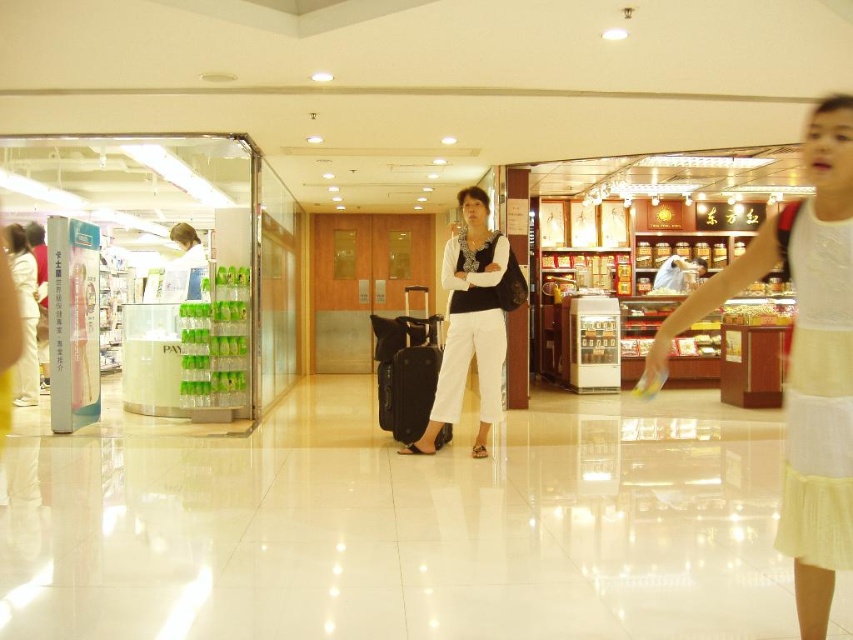
Which is more to the right, white matte pants at center or black matte suitcase at center?

white matte pants at center is more to the right.

Describe the element at coordinates (469, 323) in the screenshot. I see `white matte pants at center` at that location.

The height and width of the screenshot is (640, 853). What do you see at coordinates (469, 323) in the screenshot?
I see `white matte pants at center` at bounding box center [469, 323].

The image size is (853, 640). I want to click on white matte pants at center, so click(x=469, y=323).

Who is shorter, white cotton dress at center or white matte pants at center?

white cotton dress at center

Does white cotton dress at center have a lesser width compared to white matte pants at center?

Yes, white cotton dress at center is thinner than white matte pants at center.

The image size is (853, 640). I want to click on white cotton dress at center, so click(804, 356).

Between point (766, 253) and point (407, 435), which one is positioned in front?

Point (766, 253)

Identify the location of white cotton dress at center. The height and width of the screenshot is (640, 853). (804, 356).

In order to click on white cotton dress at center in this screenshot , I will do [804, 356].